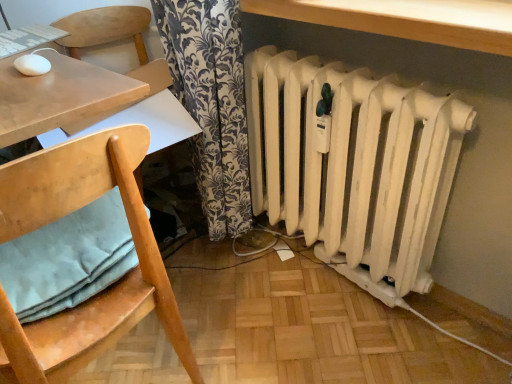
Question: Considering the relative positions of wooden chair with cushion at left and wooden table at upper center in the image provided, is wooden chair with cushion at left to the right of wooden table at upper center from the viewer's perspective?

Choices:
 (A) yes
 (B) no

Answer: (B)

Question: Is wooden chair with cushion at left positioned behind wooden table at upper center?

Choices:
 (A) no
 (B) yes

Answer: (A)

Question: Is wooden chair with cushion at left wider than wooden table at upper center?

Choices:
 (A) yes
 (B) no

Answer: (A)

Question: Is wooden table at upper center located within wooden chair with cushion at left?

Choices:
 (A) yes
 (B) no

Answer: (B)

Question: Is the depth of wooden chair with cushion at left less than that of wooden table at upper center?

Choices:
 (A) yes
 (B) no

Answer: (A)

Question: Does wooden chair with cushion at left touch wooden table at upper center?

Choices:
 (A) yes
 (B) no

Answer: (B)

Question: From a real-world perspective, is light blue fabric pillow at lower left physically above white matte radiator at lower right?

Choices:
 (A) no
 (B) yes

Answer: (B)

Question: From a real-world perspective, is light blue fabric pillow at lower left located beneath white matte radiator at lower right?

Choices:
 (A) yes
 (B) no

Answer: (B)

Question: Is light blue fabric pillow at lower left further to the viewer compared to white matte radiator at lower right?

Choices:
 (A) yes
 (B) no

Answer: (B)

Question: Is light blue fabric pillow at lower left to the left of white matte radiator at lower right from the viewer's perspective?

Choices:
 (A) yes
 (B) no

Answer: (A)

Question: Is light blue fabric pillow at lower left outside of white matte radiator at lower right?

Choices:
 (A) no
 (B) yes

Answer: (B)

Question: From the image's perspective, does light blue fabric pillow at lower left appear higher than white matte radiator at lower right?

Choices:
 (A) no
 (B) yes

Answer: (A)

Question: Does wooden table at upper center touch wooden chair with cushion at left?

Choices:
 (A) no
 (B) yes

Answer: (A)